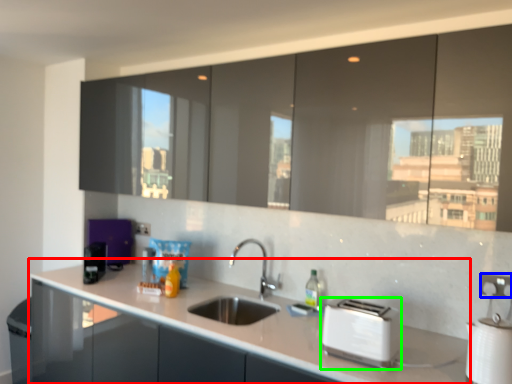
Question: Based on their relative distances, which object is farther from countertop (highlighted by a red box)? Choose from electric outlet (highlighted by a blue box) and toaster (highlighted by a green box).

Choices:
 (A) electric outlet
 (B) toaster

Answer: (A)